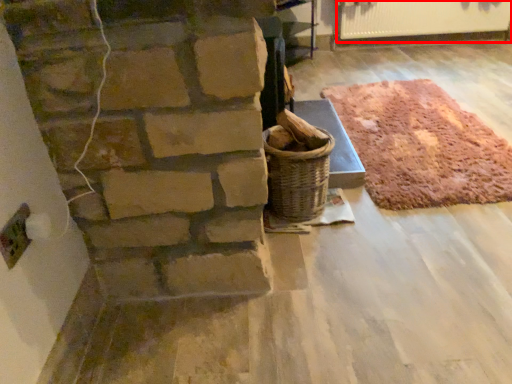
Question: From the image's perspective, where is radiator (annotated by the red box) located relative to mat?

Choices:
 (A) above
 (B) below

Answer: (A)